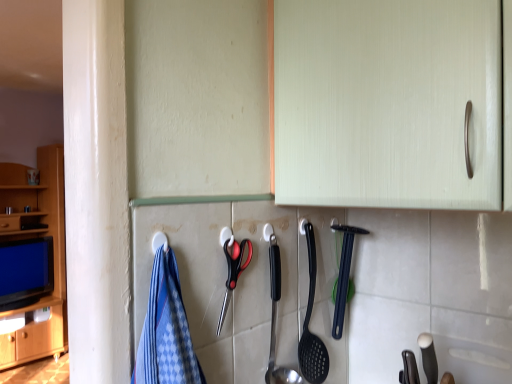
You are a GUI agent. You are given a task and a screenshot of the screen. Output one action in this format:
    pyautogui.click(x=<x>, y=<y>)
    Task: Click on the black plastic spoon at center, which ranks as the 1th silverware in right-to-left order
    
    Given the screenshot: What is the action you would take?
    pyautogui.click(x=344, y=275)

Image resolution: width=512 pixels, height=384 pixels. Identify the location of satin silver spoon at center, the first silverware from the left. click(276, 315).

I want to click on black plastic spoon at center, which ranks as the 1th silverware in right-to-left order, so click(344, 275).

From a real-world perspective, relative to black plastic scissors at center, is black plastic spoon at center, the 1th silverware when ordered from back to front, vertically above or below?

black plastic spoon at center, the 1th silverware when ordered from back to front, is below black plastic scissors at center.

Between black plastic spoon at center, which ranks as the 1th silverware in right-to-left order, and black plastic scissors at center, which one is positioned in front?

Positioned in front is black plastic scissors at center.

From the image's perspective, between black plastic spoon at center, the 1th silverware when ordered from back to front, and black plastic scissors at center, which one is located above?

black plastic scissors at center appears higher in the image.

Between point (333, 331) and point (225, 305), which one is positioned behind?

The point (333, 331) is behind.

Are satin silver spoon at center, placed as the second silverware when sorted from right to left, and black plastic scissors at center making contact?

No.

In the scene shown: What's the angular difference between satin silver spoon at center, the first silverware from the left, and black plastic scissors at center's facing directions?

0.635 degrees separate the facing orientations of satin silver spoon at center, the first silverware from the left, and black plastic scissors at center.

Is satin silver spoon at center, positioned as the 2th silverware in back-to-front order, positioned beyond the bounds of black plastic scissors at center?

That's correct, satin silver spoon at center, positioned as the 2th silverware in back-to-front order, is outside of black plastic scissors at center.

Between point (274, 307) and point (220, 317), which one is positioned in front?

Positioned in front is point (220, 317).

From a real-world perspective, is black plastic spoon at center, which ranks as the 1th silverware in right-to-left order, on satin silver spoon at center, positioned as the 2th silverware in back-to-front order?

Yes, from a real-world perspective, black plastic spoon at center, which ranks as the 1th silverware in right-to-left order, is on top of satin silver spoon at center, positioned as the 2th silverware in back-to-front order.

From the picture: Is black plastic spoon at center, acting as the second silverware starting from the left, wider or thinner than satin silver spoon at center, positioned as the 2th silverware in back-to-front order?

Considering their sizes, black plastic spoon at center, acting as the second silverware starting from the left, looks slimmer than satin silver spoon at center, positioned as the 2th silverware in back-to-front order.

Considering the positions of point (335, 307) and point (294, 374), is point (335, 307) closer or farther from the camera than point (294, 374)?

Point (335, 307) is positioned farther from the camera compared to point (294, 374).

Could you tell me if black plastic spoon at center, the 1th silverware when ordered from back to front, is turned towards satin silver spoon at center, placed as the second silverware when sorted from right to left?

No, black plastic spoon at center, the 1th silverware when ordered from back to front, is not oriented towards satin silver spoon at center, placed as the second silverware when sorted from right to left.

Is satin silver spoon at center, placed as the second silverware when sorted from right to left, at the left side of black plastic spoon at center, the 1th silverware when ordered from back to front?

Indeed, satin silver spoon at center, placed as the second silverware when sorted from right to left, is positioned on the left side of black plastic spoon at center, the 1th silverware when ordered from back to front.

Relative to black plastic spoon at center, acting as the second silverware starting from the left, is satin silver spoon at center, arranged as the first silverware when viewed from the front, in front or behind?

Visually, satin silver spoon at center, arranged as the first silverware when viewed from the front, is located in front of black plastic spoon at center, acting as the second silverware starting from the left.

Does point (293, 379) come farther from viewer compared to point (339, 315)?

No, (293, 379) is in front of (339, 315).

From the image's perspective, is satin silver spoon at center, the first silverware from the left, over black plastic spoon at center, positioned as the second silverware in front-to-back order?

Incorrect, from the image's perspective, satin silver spoon at center, the first silverware from the left, is lower than black plastic spoon at center, positioned as the second silverware in front-to-back order.

Considering the relative sizes of black plastic scissors at center and satin silver spoon at center, positioned as the 2th silverware in back-to-front order, in the image provided, is black plastic scissors at center shorter than satin silver spoon at center, positioned as the 2th silverware in back-to-front order,?

Indeed, black plastic scissors at center has a lesser height compared to satin silver spoon at center, positioned as the 2th silverware in back-to-front order.

The width and height of the screenshot is (512, 384). I want to click on silverware that is the 1st object to the right of the black plastic scissors at center, starting at the anchor, so click(x=276, y=315).

Is black plastic scissors at center to the left or to the right of satin silver spoon at center, placed as the second silverware when sorted from right to left, in the image?

From the image, it's evident that black plastic scissors at center is to the left of satin silver spoon at center, placed as the second silverware when sorted from right to left.

Which is farther, (232, 274) or (270, 261)?

Point (270, 261)

Can you confirm if black plastic scissors at center is positioned to the right of black plastic spoon at center, positioned as the second silverware in front-to-back order?

Incorrect, black plastic scissors at center is not on the right side of black plastic spoon at center, positioned as the second silverware in front-to-back order.

Considering the relative sizes of black plastic scissors at center and black plastic spoon at center, the 1th silverware when ordered from back to front, in the image provided, is black plastic scissors at center wider than black plastic spoon at center, the 1th silverware when ordered from back to front,?

No, black plastic scissors at center is not wider than black plastic spoon at center, the 1th silverware when ordered from back to front.

Considering the sizes of black plastic scissors at center and black plastic spoon at center, the 1th silverware when ordered from back to front, in the image, is black plastic scissors at center bigger or smaller than black plastic spoon at center, the 1th silverware when ordered from back to front,?

In the image, black plastic scissors at center appears to be smaller than black plastic spoon at center, the 1th silverware when ordered from back to front.

Is black plastic scissors at center next to black plastic spoon at center, positioned as the second silverware in front-to-back order, and touching it?

No, black plastic scissors at center is not making contact with black plastic spoon at center, positioned as the second silverware in front-to-back order.

Identify the location of scissors in front of the black plastic spoon at center, which ranks as the 1th silverware in right-to-left order. (233, 271).

From the black plastic scissors at center, count 1st silverware to the right and point to it. Please provide its 2D coordinates.

[(276, 315)]

Which object lies further to the anchor point satin silver spoon at center, arranged as the first silverware when viewed from the front, black plastic spoon at center, positioned as the second silverware in front-to-back order, or black plastic scissors at center?

Among the two, black plastic spoon at center, positioned as the second silverware in front-to-back order, is located further to satin silver spoon at center, arranged as the first silverware when viewed from the front.

Considering their positions, is black plastic spoon at center, acting as the second silverware starting from the left, positioned closer to black plastic scissors at center than satin silver spoon at center, arranged as the first silverware when viewed from the front?

Among the two, satin silver spoon at center, arranged as the first silverware when viewed from the front, is located nearer to black plastic scissors at center.

Which object lies further to the anchor point satin silver spoon at center, the first silverware from the left, black plastic scissors at center or black plastic spoon at center, which ranks as the 1th silverware in right-to-left order?

Among the two, black plastic spoon at center, which ranks as the 1th silverware in right-to-left order, is located further to satin silver spoon at center, the first silverware from the left.

From the image, which object appears to be nearer to black plastic scissors at center, satin silver spoon at center, the first silverware from the left, or black plastic spoon at center, the 1th silverware when ordered from back to front?

The object closer to black plastic scissors at center is satin silver spoon at center, the first silverware from the left.

Looking at the image, which one is located closer to black plastic spoon at center, the 1th silverware when ordered from back to front, black plastic scissors at center or satin silver spoon at center, arranged as the first silverware when viewed from the front?

satin silver spoon at center, arranged as the first silverware when viewed from the front, lies closer to black plastic spoon at center, the 1th silverware when ordered from back to front, than the other object.

When comparing their distances from black plastic spoon at center, positioned as the second silverware in front-to-back order, does satin silver spoon at center, the first silverware from the left, or black plastic scissors at center seem closer?

satin silver spoon at center, the first silverware from the left.

Locate an element on the screen. The width and height of the screenshot is (512, 384). silverware between black plastic scissors at center and black plastic spoon at center, acting as the second silverware starting from the left, along the z-axis is located at coordinates (276, 315).